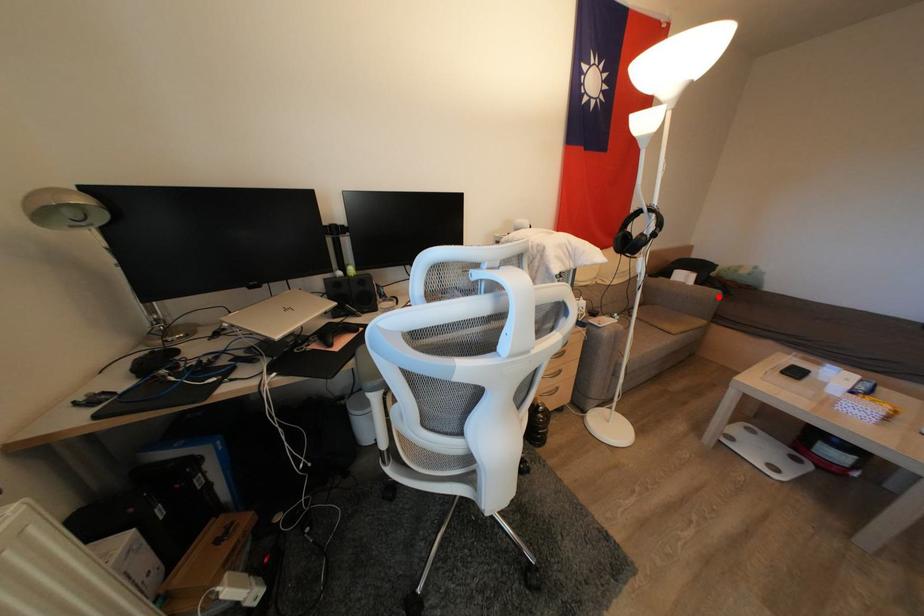
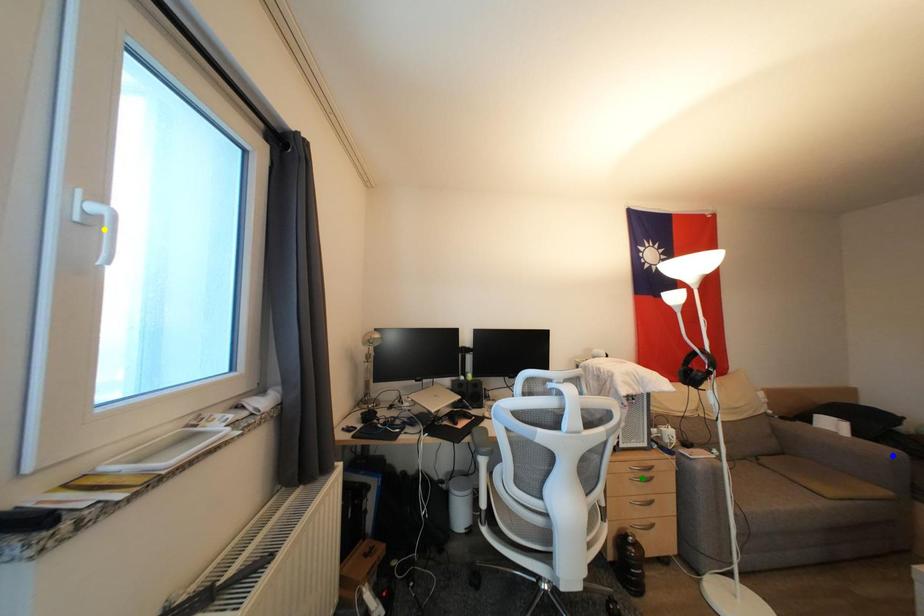
Question: I am providing you with two images of the same scene from different viewpoints. A red point is marked on the first image. You are given multiple points on the second image. Which point in image 2 represents the same 3d spot as the red point in image 1?

Choices:
 (A) yellow point
 (B) green point
 (C) blue point

Answer: (C)